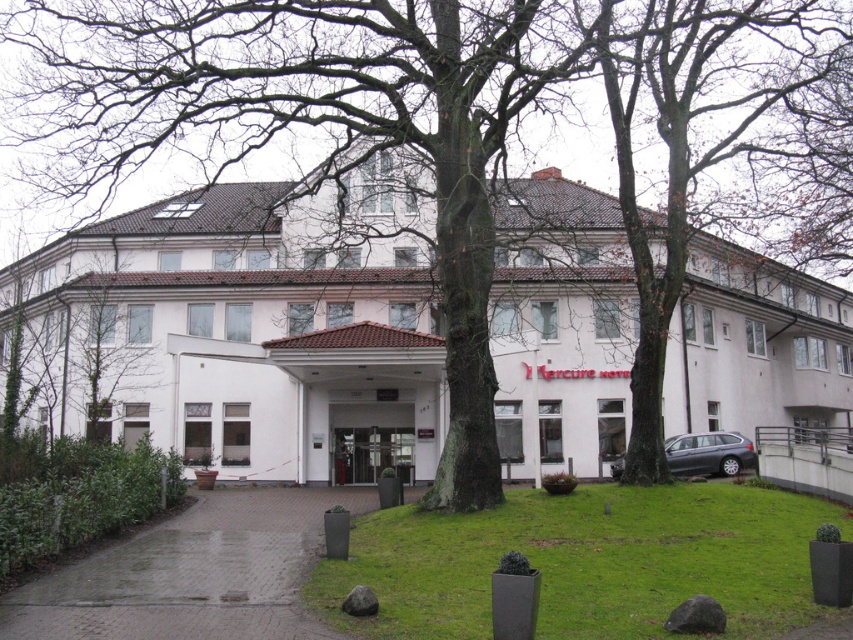
You are a delivery driver arriving at the Mercure Hotel. Your truck is parked at the lower right corner. You need to unload a large package that requires a clear path to the entrance. Considering the white matte building at center and the metallic gray car at lower right, which object might block the path if positioned incorrectly?

The metallic gray car at lower right might block the path to the entrance since it is smaller than the white matte building at center and could be parked in a way that obstructs the driveway.

Consider the image. You are standing in front of the Mercure Hotel and want to take a photo of the smooth bark tree at center. If your camera can focus on objects up to 20 meters away, will you be able to capture the tree clearly?

The smooth bark tree at center is 18.92 meters away from viewer, which is within the camera focus range of up to 20 meters. Therefore, you can capture the tree clearly.